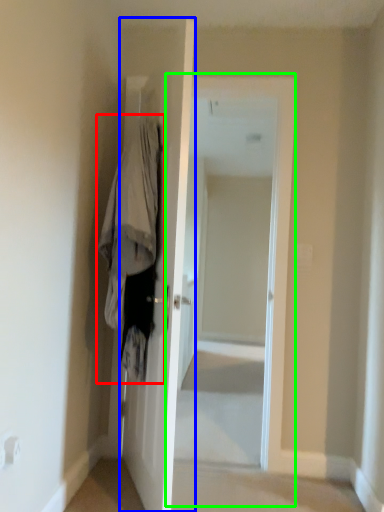
Question: Which object is positioned closest to clothing (highlighted by a red box)? Select from door (highlighted by a blue box) and screen door (highlighted by a green box).

Choices:
 (A) door
 (B) screen door

Answer: (A)